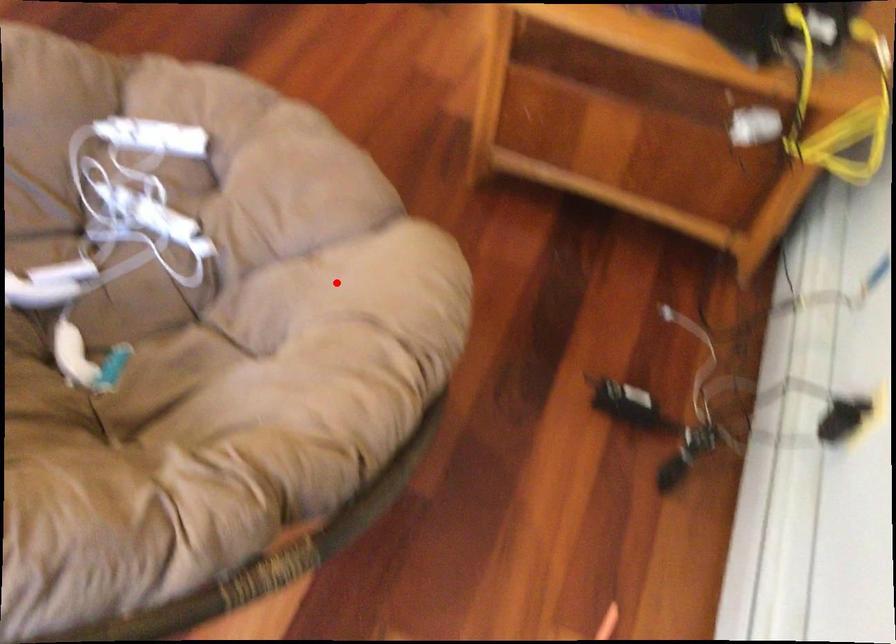
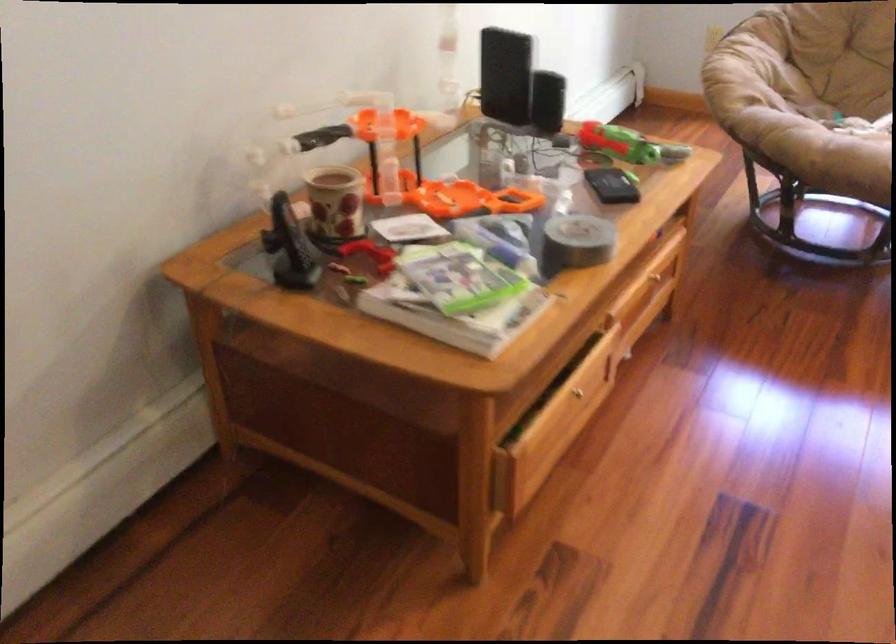
The point at the highlighted location is marked in the first image. Where is the corresponding point in the second image?

(745, 69)